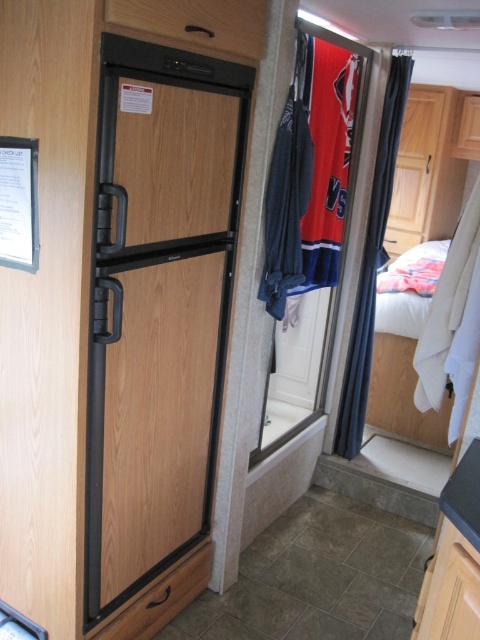
Question: Which is farther from the wooden drawer at upper center?

Choices:
 (A) black matte refrigerator at center
 (B) black wood drawer at lower center

Answer: (B)

Question: Does black matte refrigerator at center appear under wooden drawer at upper center?

Choices:
 (A) no
 (B) yes

Answer: (B)

Question: Is black matte refrigerator at center below black wood drawer at lower center?

Choices:
 (A) yes
 (B) no

Answer: (B)

Question: Which point appears closest to the camera in this image?

Choices:
 (A) (173, 22)
 (B) (112, 477)
 (C) (139, 624)

Answer: (A)

Question: Can you confirm if black matte refrigerator at center is smaller than wooden drawer at upper center?

Choices:
 (A) yes
 (B) no

Answer: (B)

Question: Considering the real-world distances, which object is closest to the black wood drawer at lower center?

Choices:
 (A) wooden drawer at upper center
 (B) black matte refrigerator at center

Answer: (B)